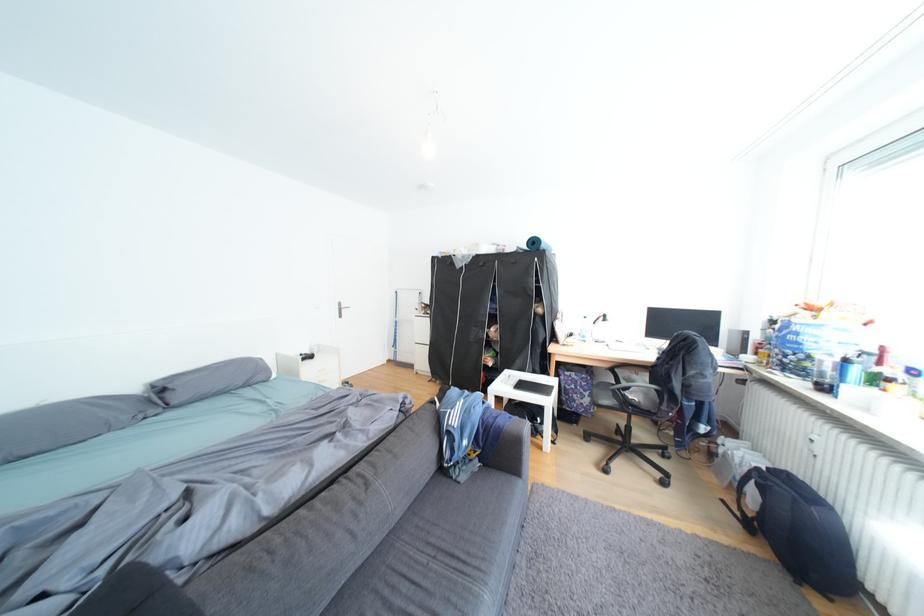
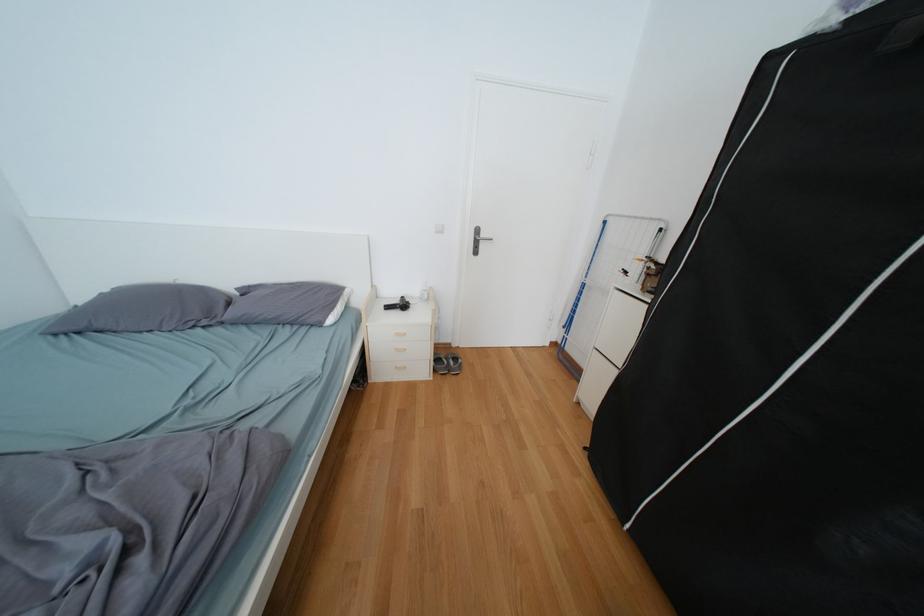
Find the pixel in the second image that matches the point at 153,418 in the first image.

(204, 323)